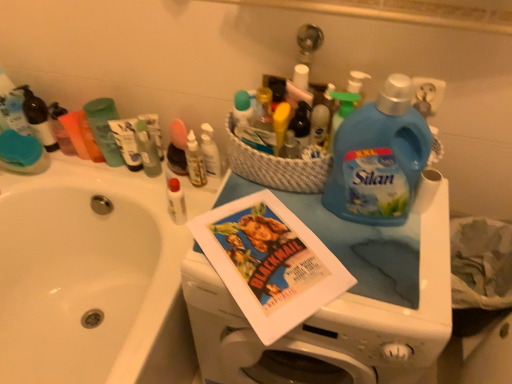
Identify the location of free space in front of matte black soap dispenser at upper left, which is the first toiletry in left-to-right order. This screenshot has height=384, width=512. (44, 173).